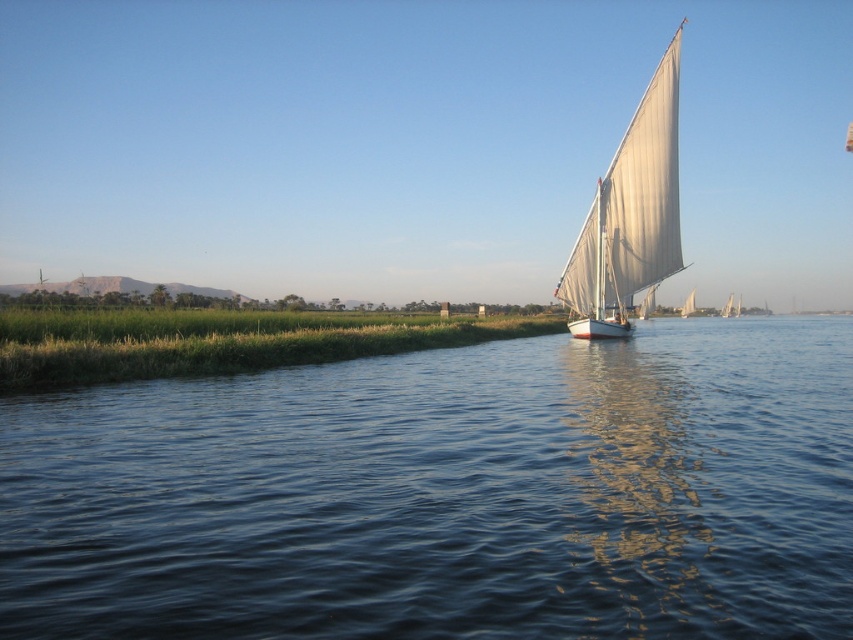
You are standing on the shore of the river and notice the blue water at center and the white canvas sailboat at right. Which object appears taller from your viewpoint?

The white canvas sailboat at right appears taller than the blue water at center because the blue water at center has a lesser height compared to the white canvas sailboat at right.

You are standing on the deck of the felucca sailboat and want to throw a lifebuoy towards a point that is behind the boat. Which of the two points, point (379,573) or point (660,266), should you aim for?

Point (660,266) is behind the boat because point (379,573) is in front of it. Therefore, you should aim for point (660,266).

You are a photographer planning to take a photo of the blue water at center and the white canvas sailboat at right. Based on their positions, which object should you place on the left side of your photo frame?

The blue water at center should be placed on the left side of the photo frame because it is positioned on the left side of the white canvas sailboat at right.